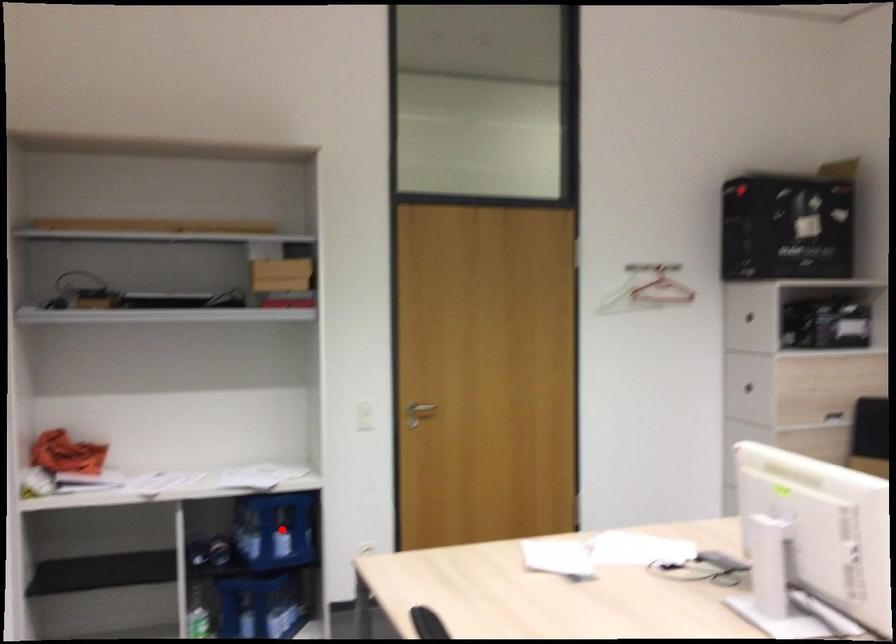
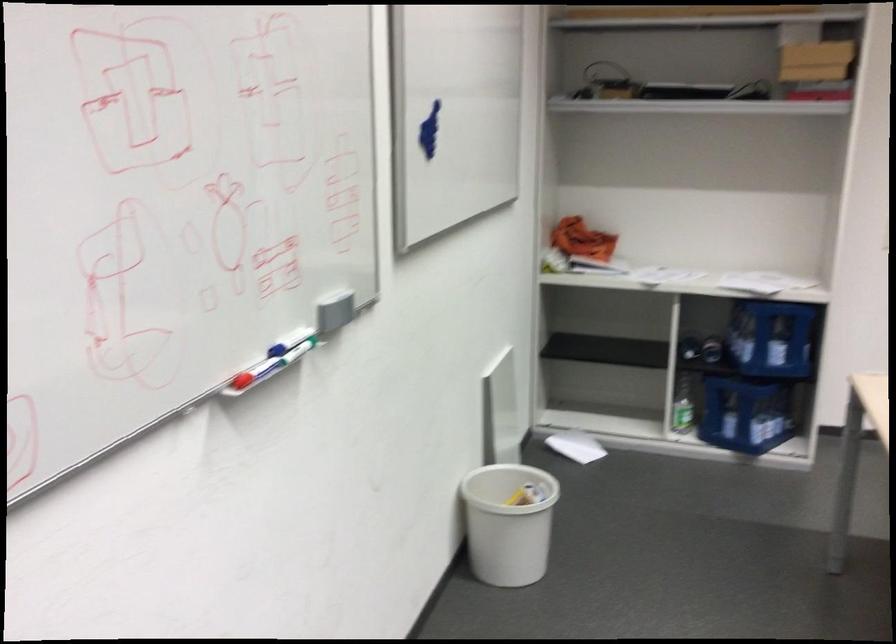
Where in the second image is the point corresponding to the highlighted location from the first image?

(771, 337)